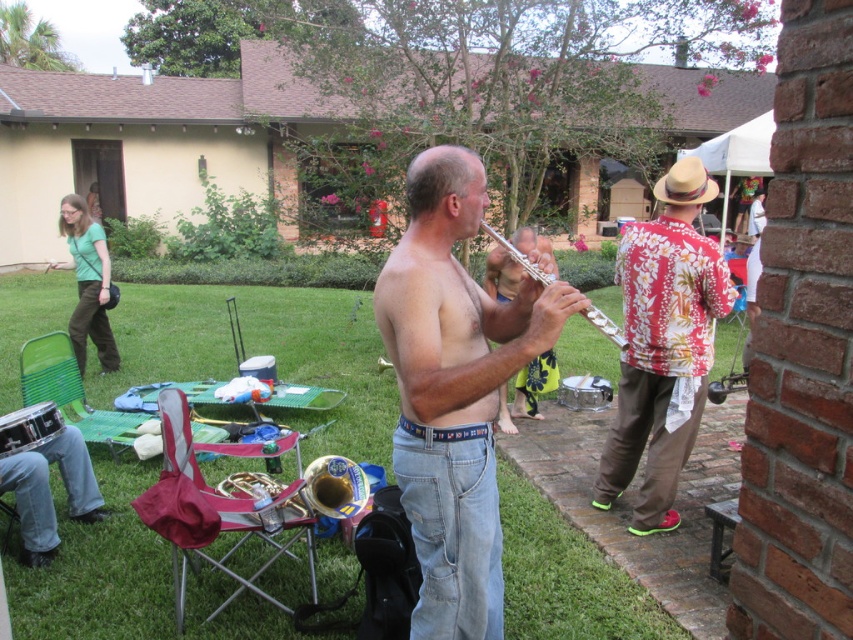
You are at a backyard party and want to place a new potted plant between the brushed metal drum at lower left and the natural straw cowboy hat at upper right. Based on their positions, where should you place the plant to ensure it is between them?

The brushed metal drum at lower left is below the natural straw cowboy hat at upper right, so placing the potted plant between them would require positioning it somewhere along the vertical axis between the two objects, ensuring it is above the drum and below the hat.

You are planning to place a small potted plant between the brushed metal drum at lower left and the natural straw cowboy hat at upper right. Given their sizes, which object should the plant be closer to?

The brushed metal drum at lower left is bigger than the natural straw cowboy hat at upper right, so the plant should be closer to the natural straw cowboy hat at upper right to balance the sizes.